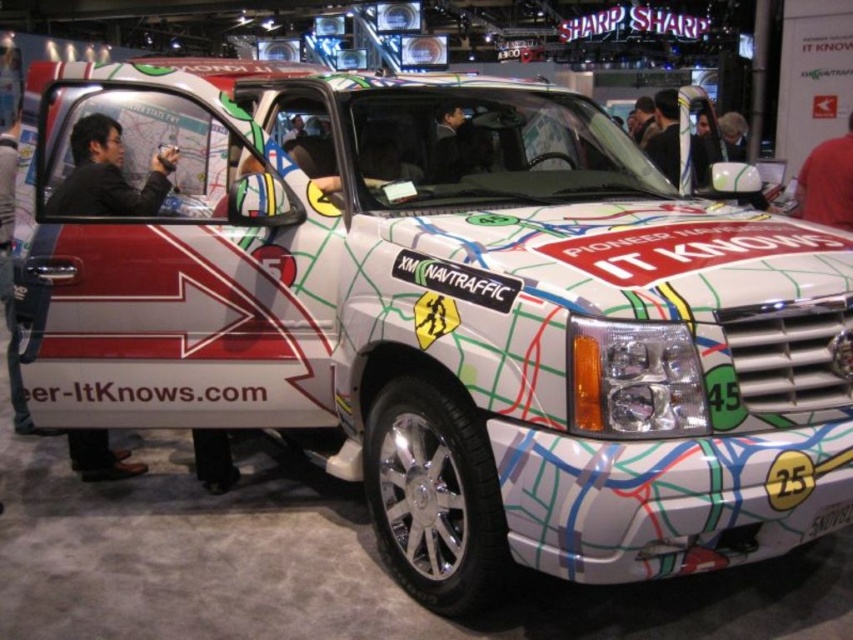
Question: Can you confirm if red shirt at upper right is smaller than black leather jacket at upper center?

Choices:
 (A) yes
 (B) no

Answer: (A)

Question: Is matte black jacket at left closer to camera compared to red shirt at upper right?

Choices:
 (A) yes
 (B) no

Answer: (A)

Question: Estimate the real-world distances between objects in this image. Which object is closer to the black leather jacket at upper center?

Choices:
 (A) red shirt at upper right
 (B) matte black jacket at left

Answer: (A)

Question: Which is farther from the matte black jacket at left?

Choices:
 (A) red shirt at upper right
 (B) black leather jacket at upper center

Answer: (A)

Question: Can you confirm if red shirt at upper right is positioned above black leather jacket at upper center?

Choices:
 (A) yes
 (B) no

Answer: (B)

Question: Which of the following is the farthest from the observer?

Choices:
 (A) black leather jacket at upper center
 (B) matte black jacket at left

Answer: (A)